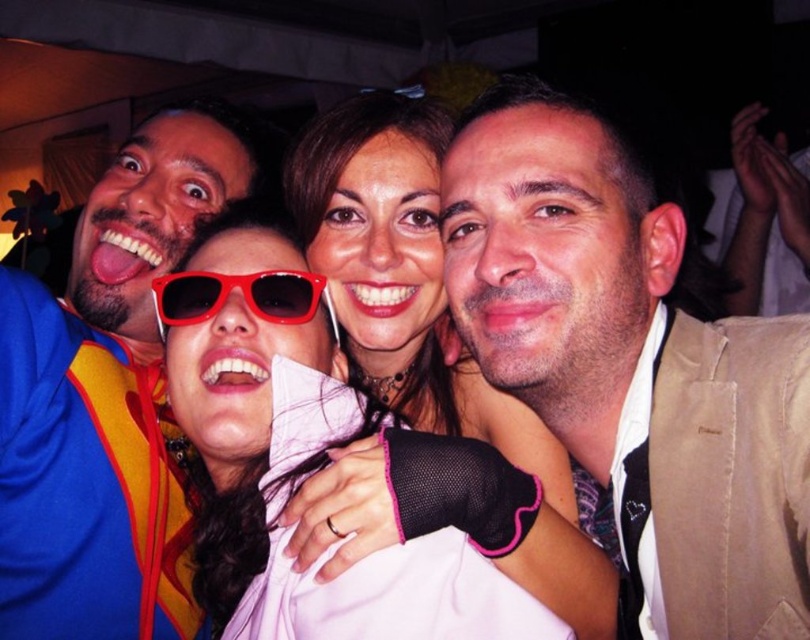
Question: Which of the following is the closest to the observer?

Choices:
 (A) (141, 556)
 (B) (727, 326)
 (C) (233, 308)

Answer: (B)

Question: Is beige textured jacket at upper right bigger than red plastic sunglasses at center?

Choices:
 (A) no
 (B) yes

Answer: (B)

Question: Which point is closer to the camera?

Choices:
 (A) (271, 276)
 (B) (544, 420)

Answer: (A)

Question: Which of these objects is positioned farthest from the beige textured jacket at upper right?

Choices:
 (A) matte plastic sunglasses at center
 (B) blue fleece jacket at upper left

Answer: (B)

Question: Does blue fleece jacket at upper left have a greater width compared to matte plastic sunglasses at center?

Choices:
 (A) yes
 (B) no

Answer: (B)

Question: Does matte plastic sunglasses at center appear on the right side of red plastic sunglasses at center?

Choices:
 (A) yes
 (B) no

Answer: (A)